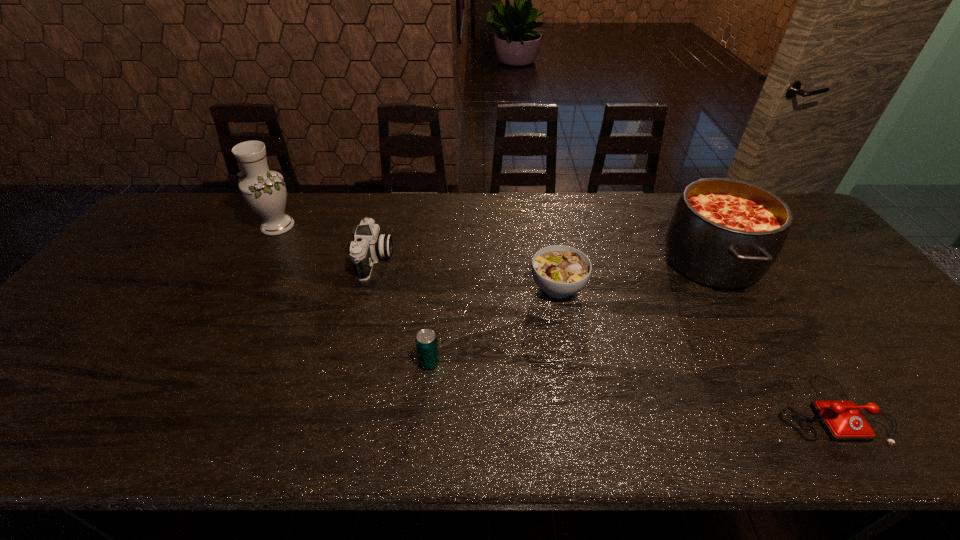
You are a GUI agent. You are given a task and a screenshot of the screen. Output one action in this format:
    pyautogui.click(x=<x>, y=<y>)
    Task: Click on the leftmost object
    The image size is (960, 540).
    Given the screenshot: What is the action you would take?
    pyautogui.click(x=264, y=190)

At what (x,y) coordinates should I click in order to perform the action: click on vase. Please return your answer as a coordinate pair (x, y). This screenshot has width=960, height=540. Looking at the image, I should click on (264, 190).

Locate an element on the screen. Image resolution: width=960 pixels, height=540 pixels. casserole is located at coordinates (726, 233).

Locate an element on the screen. The width and height of the screenshot is (960, 540). the third tallest object is located at coordinates (368, 246).

Find the location of `camera`. camera is located at coordinates (368, 246).

The width and height of the screenshot is (960, 540). Find the location of `the fifth farthest object`. the fifth farthest object is located at coordinates (426, 341).

The image size is (960, 540). I want to click on beer can, so click(426, 341).

You are a GUI agent. You are given a task and a screenshot of the screen. Output one action in this format:
    pyautogui.click(x=<x>, y=<y>)
    Task: Click on the third object from right to left
    
    Given the screenshot: What is the action you would take?
    pyautogui.click(x=560, y=271)

This screenshot has width=960, height=540. Find the location of `the nearest object`. the nearest object is located at coordinates (842, 420).

Image resolution: width=960 pixels, height=540 pixels. Find the location of `telephone`. telephone is located at coordinates (842, 420).